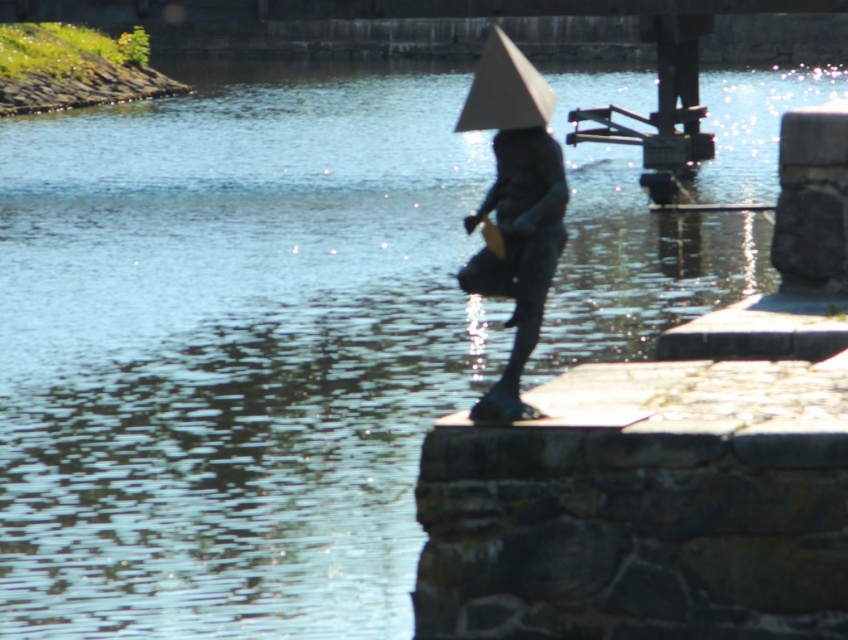
Question: Which of the following is the farthest from the observer?

Choices:
 (A) (550, 176)
 (B) (530, 106)

Answer: (A)

Question: Is shiny bronze statue at center thinner than white paper umbrella at center?

Choices:
 (A) no
 (B) yes

Answer: (B)

Question: Which of the following is the closest to the observer?

Choices:
 (A) (509, 65)
 (B) (478, 90)

Answer: (A)

Question: Is shiny bronze statue at center wider than white paper umbrella at center?

Choices:
 (A) yes
 (B) no

Answer: (B)

Question: Can you confirm if shiny bronze statue at center is bigger than white paper umbrella at center?

Choices:
 (A) yes
 (B) no

Answer: (A)